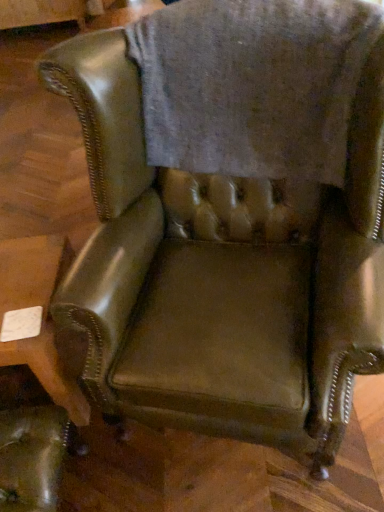
Identify the location of wooden table at lower left. (43, 314).

Describe the element at coordinates (43, 314) in the screenshot. I see `wooden table at lower left` at that location.

In order to click on wooden table at lower left in this screenshot , I will do `click(43, 314)`.